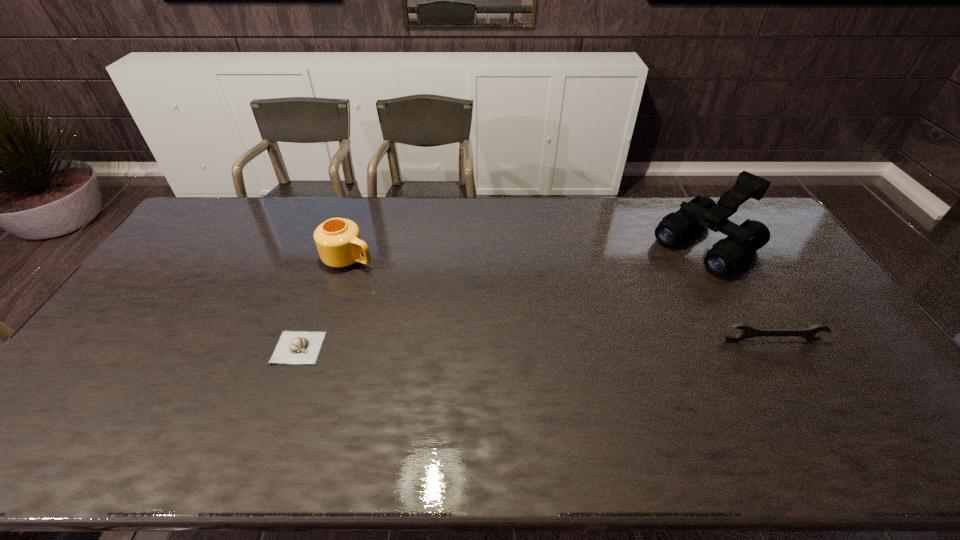
Identify the location of vacant space on the desktop that is between the shortest object and the wrench and is positioned on the front lenses of the binoculars. pos(571,343).

Identify the location of vacant space on the desktop that is between the garlic and the third tallest object and is positioned on the handle side of the third shortest object. This screenshot has width=960, height=540. (552, 343).